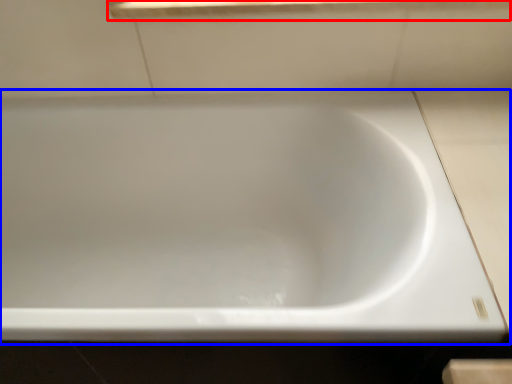
Question: Among these objects, which one is farthest to the camera, window sill (highlighted by a red box) or bathtub (highlighted by a blue box)?

Choices:
 (A) window sill
 (B) bathtub

Answer: (A)